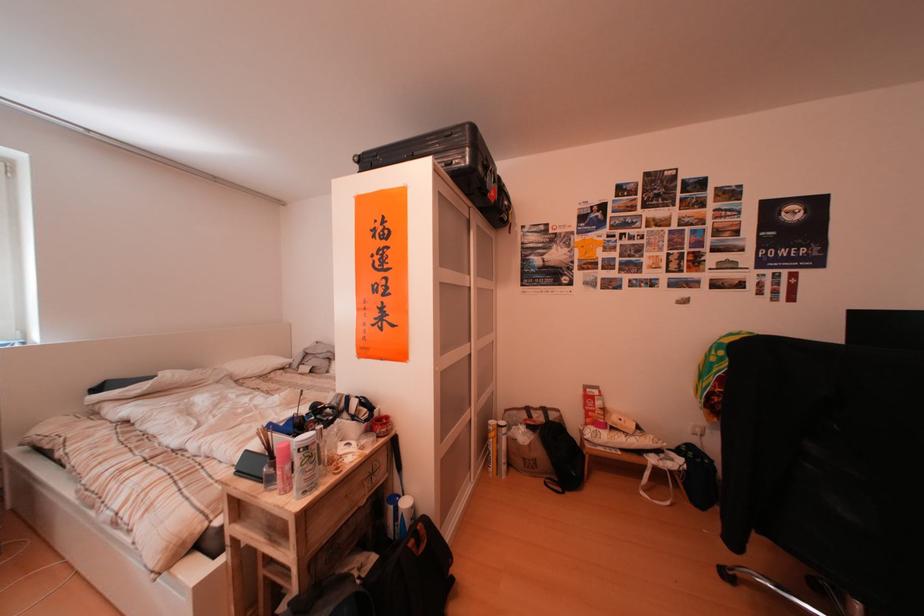
Find where to lift the tennis ball tube. Please return your answer as a coordinate pair (x, y).

(500, 456)